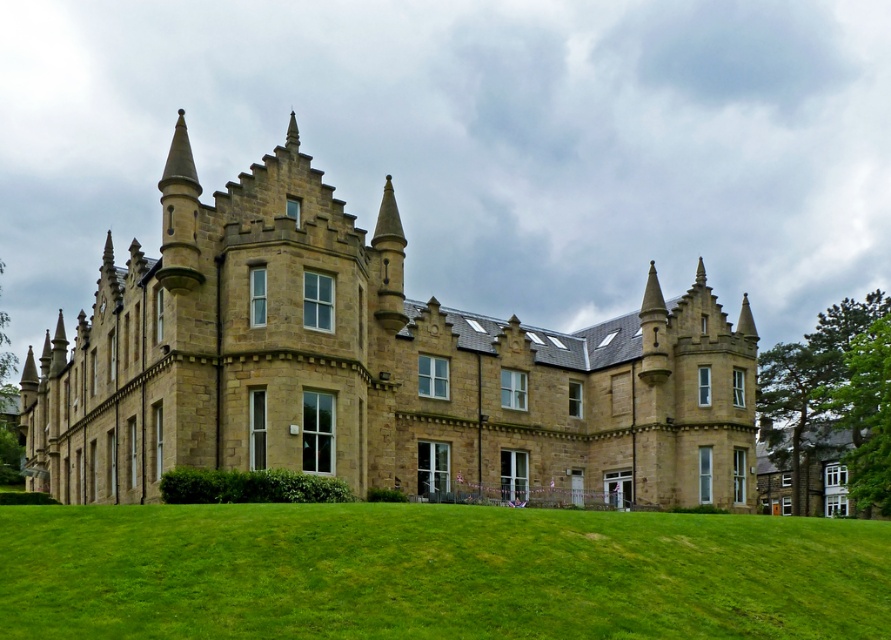
You are standing on the green grassy field at lower center and want to take a photo of the brown stone castle at center. Which direction should you face to ensure the castle is fully visible in your camera frame?

Since the green grassy field at lower center is behind the brown stone castle at center, you should face towards the direction opposite of the field to have the castle in view.

You are standing on the green grassy field at lower center and want to reach the brown stone castle at center. Which direction should you move to get there?

You should move upward to reach the brown stone castle at center since it is above the green grassy field at lower center.